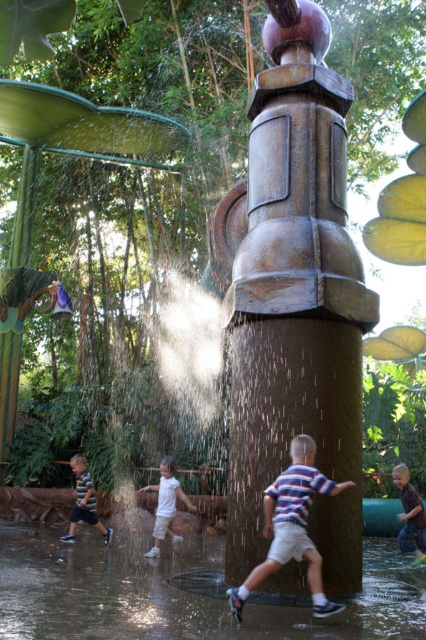
Question: Which of the following is the farthest from the observer?

Choices:
 (A) [x=31, y=529]
 (B) [x=423, y=520]
 (C) [x=172, y=515]

Answer: (A)

Question: Which object is farther from the camera taking this photo?

Choices:
 (A) metallic water at center
 (B) white cotton shirt at center
 (C) striped cotton shirt at lower left

Answer: (C)

Question: Which point is closer to the camera taking this photo?

Choices:
 (A) (94, 508)
 (B) (173, 493)
 (C) (89, 563)

Answer: (C)

Question: Is brown cotton shirt at center thinner than white cotton shirt at center?

Choices:
 (A) no
 (B) yes

Answer: (B)

Question: Can you confirm if metallic water at center is positioned above white cotton shirt at center?

Choices:
 (A) no
 (B) yes

Answer: (B)

Question: Is striped cotton shirt at center wider than white cotton shirt at center?

Choices:
 (A) no
 (B) yes

Answer: (B)